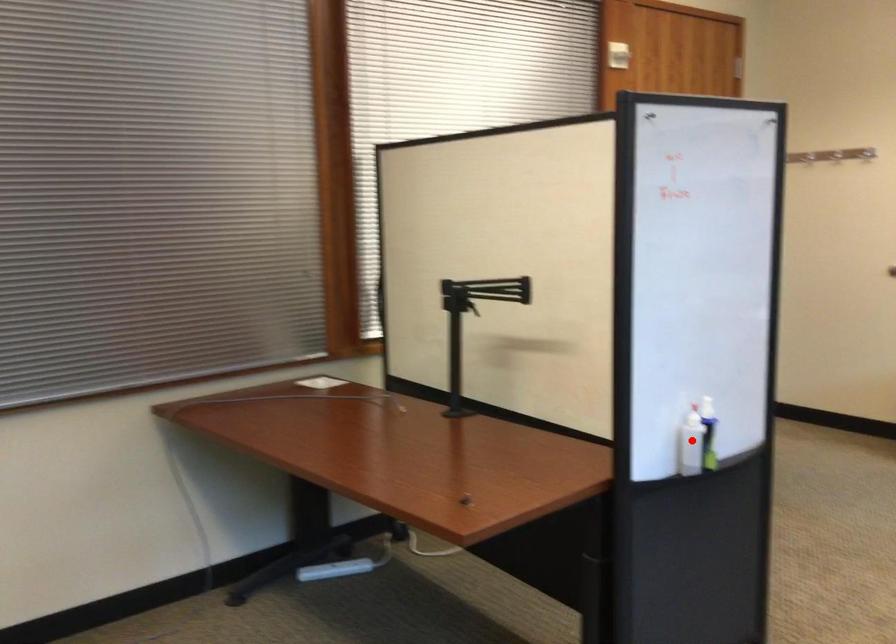
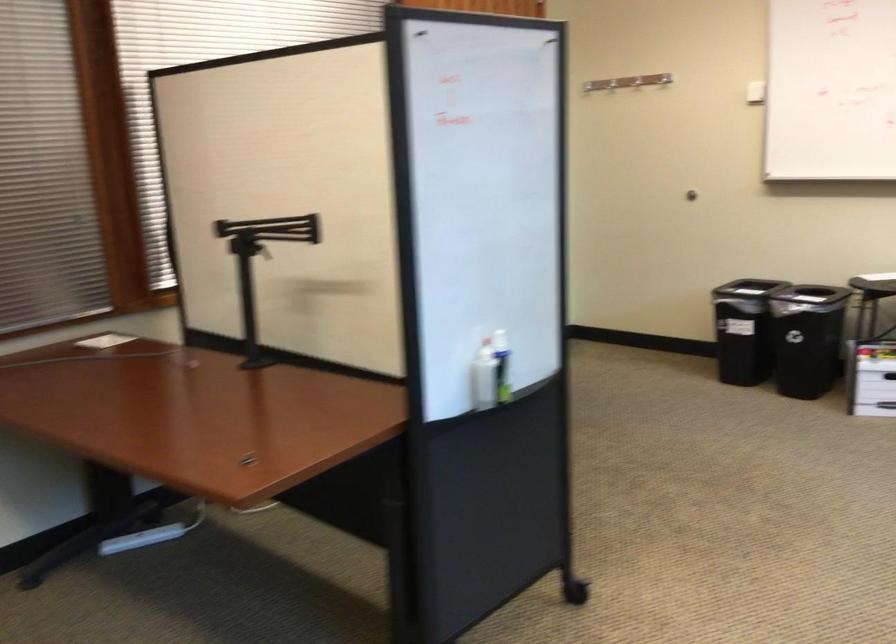
In the second image, find the point that corresponds to the highlighted location in the first image.

(483, 377)